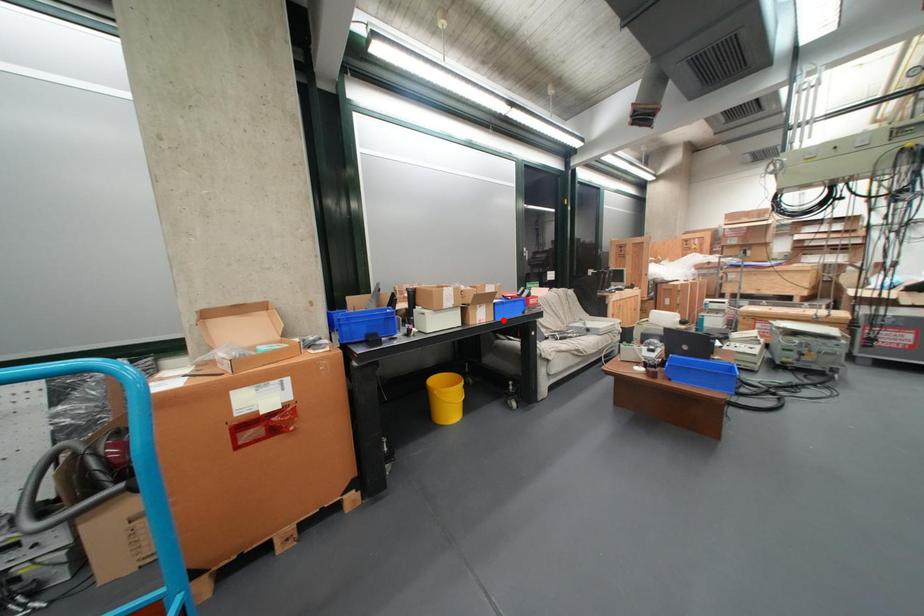
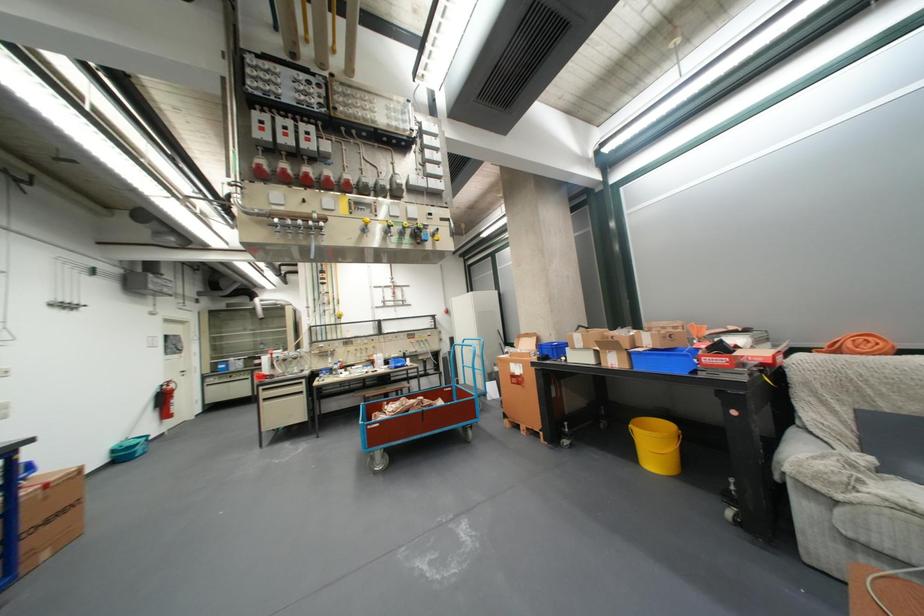
Find the pixel in the second image that matches the highlighted location in the first image.

(638, 368)